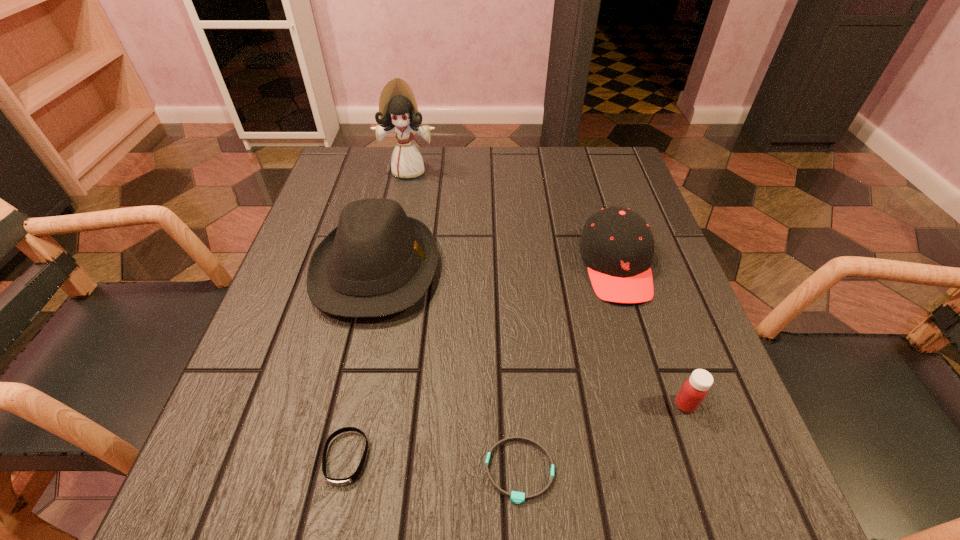
Identify the location of free space at the far edge. The height and width of the screenshot is (540, 960). (468, 197).

Image resolution: width=960 pixels, height=540 pixels. In the image, there is a desktop. Find the location of `vacant space at the near edge`. vacant space at the near edge is located at coordinates (588, 485).

Locate an element on the screen. The height and width of the screenshot is (540, 960). vacant area at the left edge of the desktop is located at coordinates (251, 401).

In the image, there is a desktop. Where is `blank space at the right edge`? The width and height of the screenshot is (960, 540). blank space at the right edge is located at coordinates (642, 315).

Where is `blank space at the far left corner of the desktop`? This screenshot has width=960, height=540. blank space at the far left corner of the desktop is located at coordinates (369, 157).

You are a GUI agent. You are given a task and a screenshot of the screen. Output one action in this format:
    pyautogui.click(x=<x>, y=<y>)
    Task: Click on the vacant region at the near left corner of the desktop
    The image size is (960, 540).
    Given the screenshot: What is the action you would take?
    pyautogui.click(x=191, y=522)

This screenshot has width=960, height=540. Find the location of `vacant region at the far right corner of the desktop`. vacant region at the far right corner of the desktop is located at coordinates (595, 171).

Where is `vacant area that lies between the second tallest object and the fourth shortest object`? Image resolution: width=960 pixels, height=540 pixels. vacant area that lies between the second tallest object and the fourth shortest object is located at coordinates (496, 267).

Locate an element on the screen. The height and width of the screenshot is (540, 960). unoccupied position between the farthest object and the third nearest object is located at coordinates (547, 287).

Where is `free space between the shorter wristband and the fifth shortest object`? free space between the shorter wristband and the fifth shortest object is located at coordinates (448, 370).